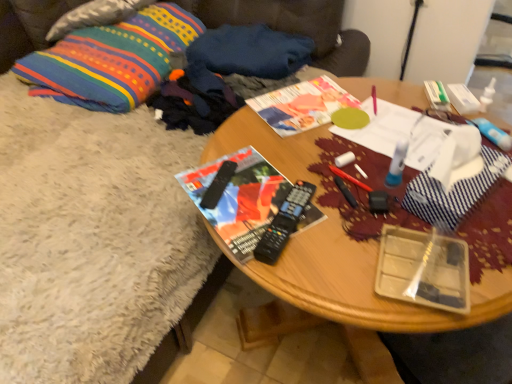
Question: From the image's perspective, would you say wooden table at center is shown under matte black magazine at center?

Choices:
 (A) no
 (B) yes

Answer: (B)

Question: Would you say matte black magazine at center is part of wooden table at center's contents?

Choices:
 (A) yes
 (B) no

Answer: (A)

Question: From a real-world perspective, does wooden table at center sit lower than matte black magazine at center?

Choices:
 (A) yes
 (B) no

Answer: (A)

Question: Is wooden table at center with matte black magazine at center?

Choices:
 (A) no
 (B) yes

Answer: (A)

Question: Is wooden table at center oriented away from matte black magazine at center?

Choices:
 (A) yes
 (B) no

Answer: (B)

Question: Is black plastic remote control at center, which is the 2th remote control in right-to-left order, situated inside matte black magazine at center or outside?

Choices:
 (A) outside
 (B) inside

Answer: (B)

Question: Considering the positions of black plastic remote control at center, the 1th remote control positioned from the left, and matte black magazine at center in the image, is black plastic remote control at center, the 1th remote control positioned from the left, bigger or smaller than matte black magazine at center?

Choices:
 (A) small
 (B) big

Answer: (A)

Question: Looking at their shapes, would you say black plastic remote control at center, which is the 2th remote control in right-to-left order, is wider or thinner than matte black magazine at center?

Choices:
 (A) wide
 (B) thin

Answer: (B)

Question: From the image's perspective, relative to matte black magazine at center, is black plastic remote control at center, which is the 2th remote control in right-to-left order, above or below?

Choices:
 (A) below
 (B) above

Answer: (B)

Question: Is point (66, 29) closer or farther from the camera than point (278, 251)?

Choices:
 (A) closer
 (B) farther

Answer: (B)

Question: Considering their positions, is textured cotton pillow at upper left, the first pillow viewed from the top, located in front of or behind black plastic remote control at center, which is the 2th remote control from left to right?

Choices:
 (A) behind
 (B) front

Answer: (A)

Question: From a real-world perspective, is textured cotton pillow at upper left, which is counted as the 2th pillow, starting from the bottom, physically located above or below black plastic remote control at center, which is the 2th remote control from left to right?

Choices:
 (A) below
 (B) above

Answer: (A)

Question: Would you say textured cotton pillow at upper left, which is counted as the 2th pillow, starting from the bottom, is to the left or to the right of black plastic remote control at center, which is the 2th remote control from left to right, in the picture?

Choices:
 (A) left
 (B) right

Answer: (A)

Question: From the image's perspective, is dark blue fabric at upper center, the 1th clothing when ordered from back to front, positioned above or below multicolored woven pillow at upper left, positioned as the 1th pillow in bottom-to-top order?

Choices:
 (A) below
 (B) above

Answer: (A)

Question: Which is correct: dark blue fabric at upper center, the 1th clothing when ordered from back to front, is inside multicolored woven pillow at upper left, the second pillow from the top, or outside of it?

Choices:
 (A) outside
 (B) inside

Answer: (A)